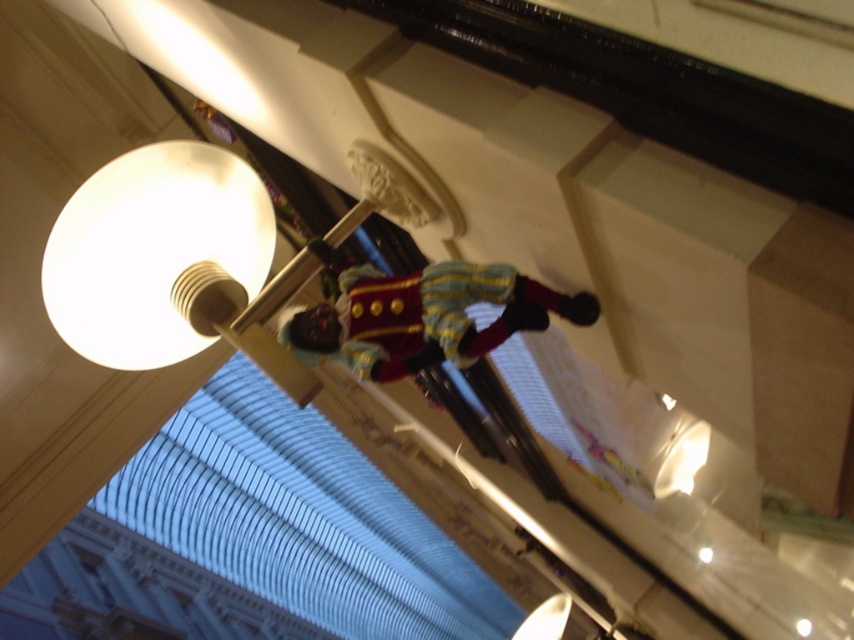
Question: Which of the following is the farthest from the observer?

Choices:
 (A) (150, 276)
 (B) (347, 349)

Answer: (B)

Question: Among these objects, which one is farthest from the camera?

Choices:
 (A) white matte lamp at upper left
 (B) velvet gold-trimmed toy soldier at center

Answer: (B)

Question: Which of the following is the closest to the observer?

Choices:
 (A) white matte lamp at upper left
 (B) velvet gold-trimmed toy soldier at center

Answer: (A)

Question: Is white matte lamp at upper left bigger than velvet gold-trimmed toy soldier at center?

Choices:
 (A) no
 (B) yes

Answer: (A)

Question: Can you confirm if white matte lamp at upper left is thinner than velvet gold-trimmed toy soldier at center?

Choices:
 (A) no
 (B) yes

Answer: (B)

Question: Is white matte lamp at upper left thinner than velvet gold-trimmed toy soldier at center?

Choices:
 (A) no
 (B) yes

Answer: (B)